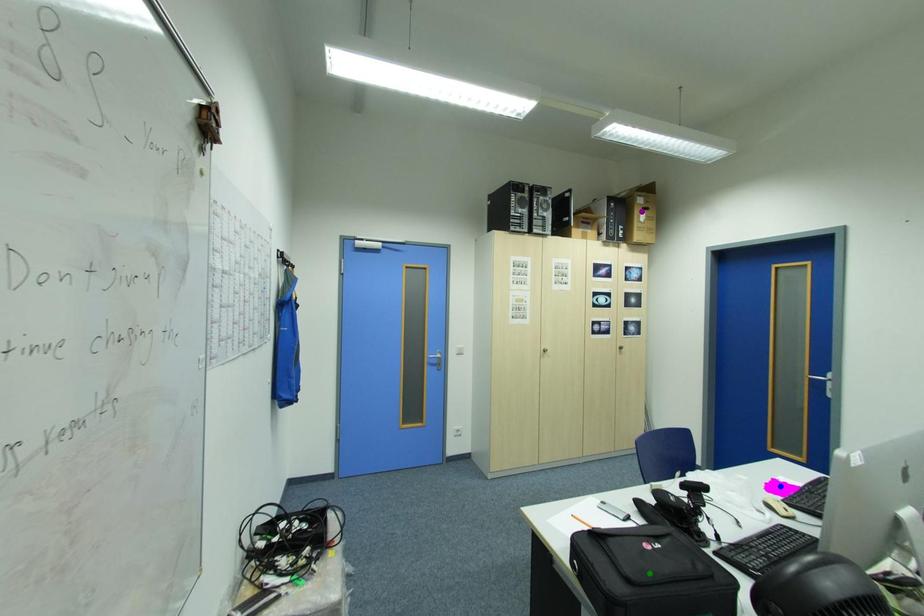
Order these from nearest to farthest:
1. purple point
2. green point
3. blue point

green point → blue point → purple point